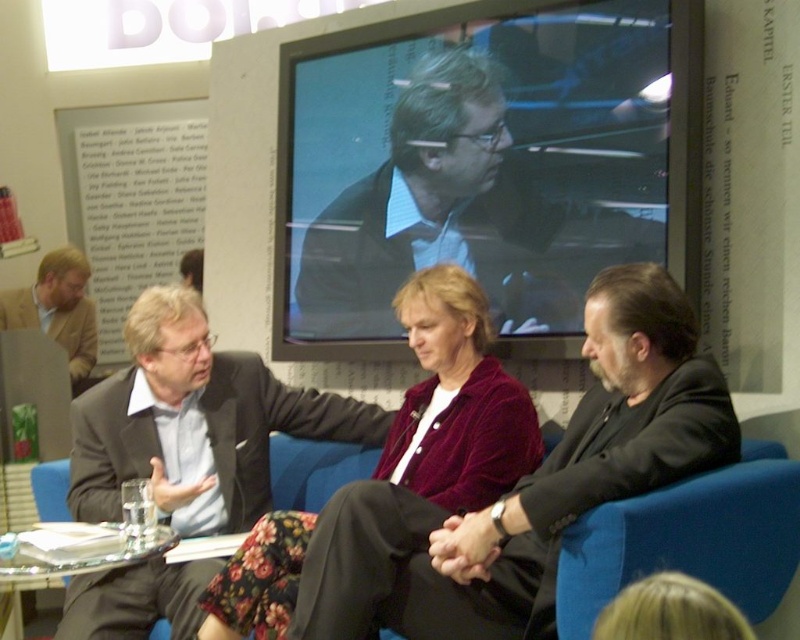
Question: Which of these objects is positioned farthest from the blue fabric armchair at lower right?

Choices:
 (A) black velvet suit at center
 (B) clear glass table at lower left

Answer: (B)

Question: In this image, where is matte gray suit at center located relative to light brown suit at left?

Choices:
 (A) left
 (B) right

Answer: (B)

Question: In this image, where is black velvet suit at center located relative to matte black suit at center?

Choices:
 (A) above
 (B) below

Answer: (B)

Question: Which object appears farthest from the camera in this image?

Choices:
 (A) matte gray suit at center
 (B) black velvet suit at center

Answer: (A)

Question: Which point appears farthest from the camera in this image?

Choices:
 (A) (140, 412)
 (B) (356, 184)
 (C) (472, 362)
 (D) (81, 544)

Answer: (B)

Question: Is matte black suit at center positioned at the back of clear glass table at lower left?

Choices:
 (A) yes
 (B) no

Answer: (A)